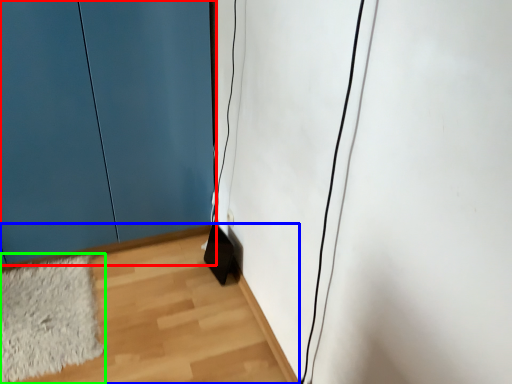
Question: Estimate the real-world distances between objects in this image. Which object is farther from door (highlighted by a red box), corridor (highlighted by a blue box) or mat (highlighted by a green box)?

Choices:
 (A) corridor
 (B) mat

Answer: (A)